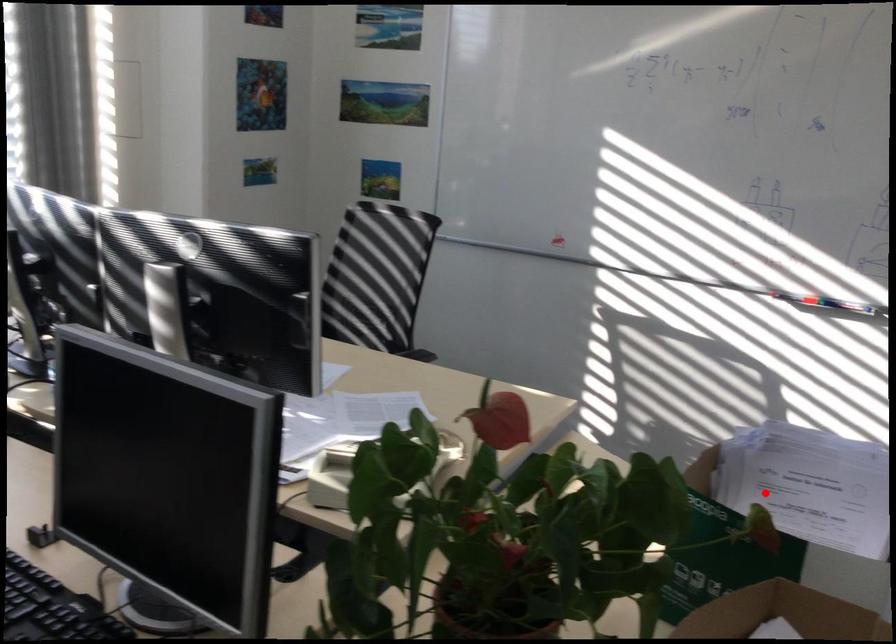
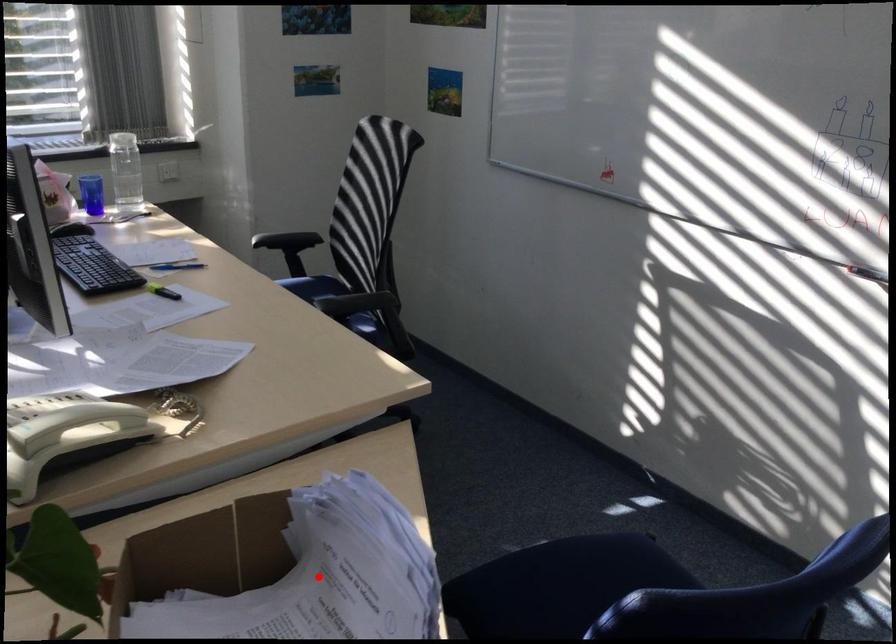
I am providing you with two images of the same scene from different viewpoints. A red point is marked on the first image and another point is marked on the second image. Do the highlighted points in image1 and image2 indicate the same real-world spot?

Yes